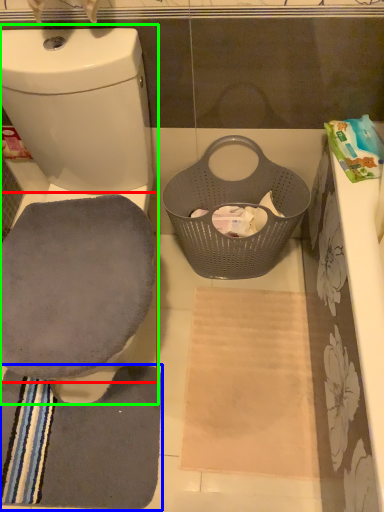
Question: Considering the real-world distances, which object is farthest from swivel chair (highlighted by a red box)? bath towel (highlighted by a blue box) or toilet (highlighted by a green box)?

Choices:
 (A) bath towel
 (B) toilet

Answer: (A)